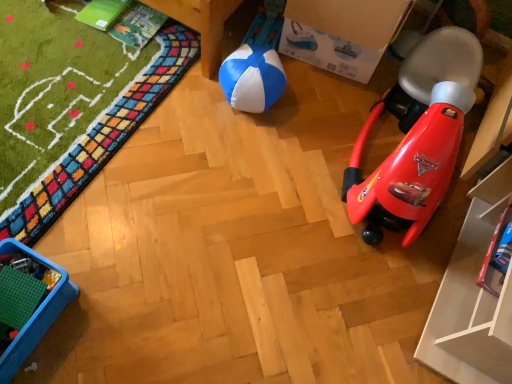
Locate an element on the screen. The height and width of the screenshot is (384, 512). free space above blue plastic tray at lower left (from a real-world perspective) is located at coordinates (15, 291).